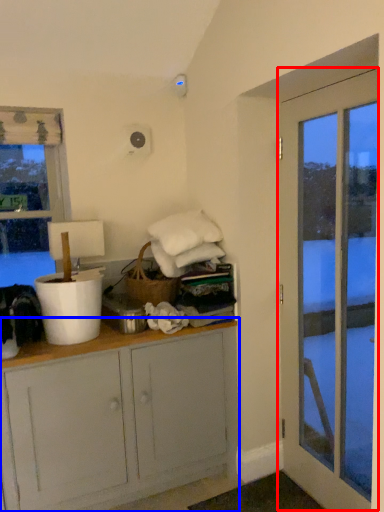
Question: Which of the following is the closest to the observer, door (highlighted by a red box) or cabinetry (highlighted by a blue box)?

Choices:
 (A) door
 (B) cabinetry

Answer: (A)